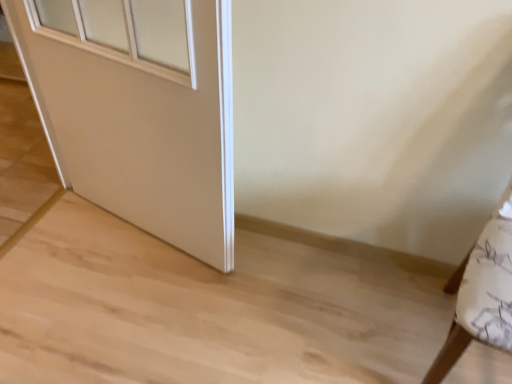
Question: Is the surface of white matte door at center in direct contact with white fabric cushion at right?

Choices:
 (A) yes
 (B) no

Answer: (B)

Question: From the image's perspective, would you say white matte door at center is positioned over white fabric cushion at right?

Choices:
 (A) yes
 (B) no

Answer: (A)

Question: Is white matte door at center facing towards white fabric cushion at right?

Choices:
 (A) yes
 (B) no

Answer: (B)

Question: Is white matte door at center not inside white fabric cushion at right?

Choices:
 (A) yes
 (B) no

Answer: (A)

Question: Is white matte door at center shorter than white fabric cushion at right?

Choices:
 (A) no
 (B) yes

Answer: (A)

Question: From the image's perspective, does white matte door at center appear lower than white fabric cushion at right?

Choices:
 (A) no
 (B) yes

Answer: (A)

Question: Is white fabric cushion at right to the left of white matte door at center from the viewer's perspective?

Choices:
 (A) no
 (B) yes

Answer: (A)

Question: From the image's perspective, is white fabric cushion at right under white matte door at center?

Choices:
 (A) yes
 (B) no

Answer: (A)

Question: Can you confirm if white fabric cushion at right is positioned to the right of white matte door at center?

Choices:
 (A) yes
 (B) no

Answer: (A)

Question: Are white fabric cushion at right and white matte door at center far apart?

Choices:
 (A) yes
 (B) no

Answer: (A)

Question: Does white fabric cushion at right have a lesser height compared to white matte door at center?

Choices:
 (A) yes
 (B) no

Answer: (A)

Question: From a real-world perspective, is white fabric cushion at right below white matte door at center?

Choices:
 (A) no
 (B) yes

Answer: (B)

Question: Is point (507, 195) positioned closer to the camera than point (82, 168)?

Choices:
 (A) closer
 (B) farther

Answer: (A)